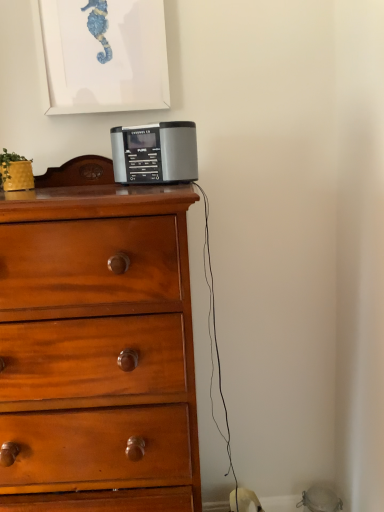
Question: Is wooden chest of drawers at center spatially inside silver/black plastic radio at center, or outside of it?

Choices:
 (A) inside
 (B) outside

Answer: (B)

Question: Considering the relative positions of wooden chest of drawers at center and silver/black plastic radio at center in the image provided, is wooden chest of drawers at center to the left or to the right of silver/black plastic radio at center?

Choices:
 (A) right
 (B) left

Answer: (B)

Question: Is wooden chest of drawers at center wider or thinner than silver/black plastic radio at center?

Choices:
 (A) wide
 (B) thin

Answer: (A)

Question: From the image's perspective, is silver/black plastic radio at center positioned above or below wooden chest of drawers at center?

Choices:
 (A) above
 (B) below

Answer: (A)

Question: From a real-world perspective, is silver/black plastic radio at center physically located above or below wooden chest of drawers at center?

Choices:
 (A) above
 (B) below

Answer: (A)

Question: In the image, is silver/black plastic radio at center on the left side or the right side of wooden chest of drawers at center?

Choices:
 (A) right
 (B) left

Answer: (A)

Question: In terms of width, does silver/black plastic radio at center look wider or thinner when compared to wooden chest of drawers at center?

Choices:
 (A) wide
 (B) thin

Answer: (B)